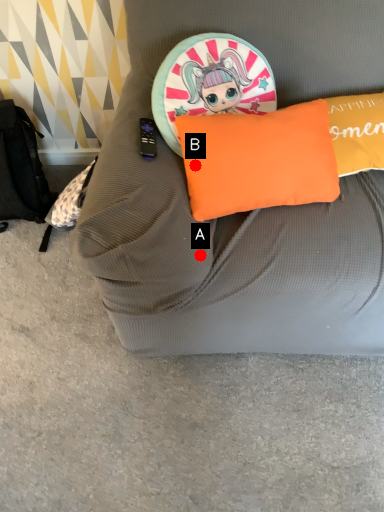
Question: Two points are circled on the image, labeled by A and B beside each circle. Which point is closer to the camera taking this photo?

Choices:
 (A) A is closer
 (B) B is closer

Answer: (A)